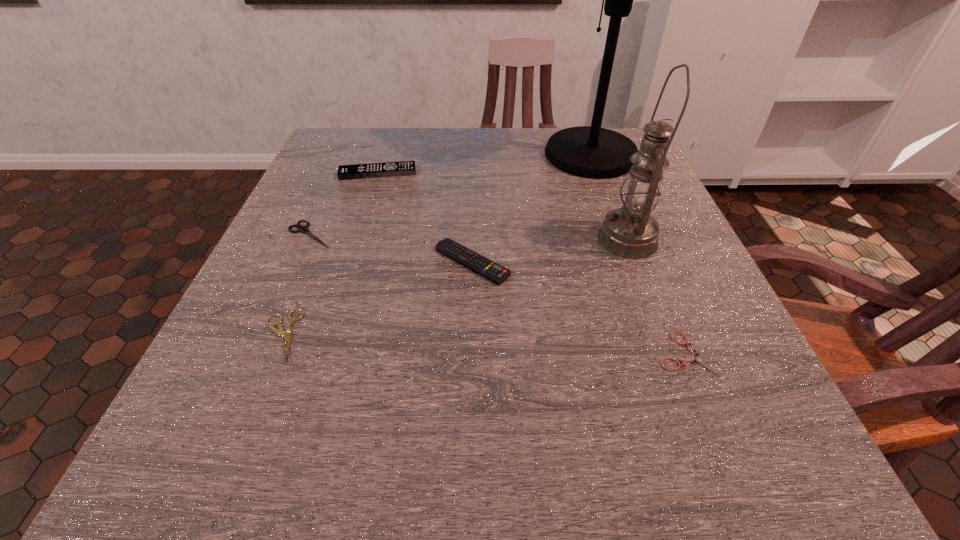
This screenshot has height=540, width=960. I want to click on table lamp, so click(593, 152).

Where is `the second tallest object`? the second tallest object is located at coordinates (631, 232).

Where is `the fifth shortest object`? This screenshot has width=960, height=540. the fifth shortest object is located at coordinates (404, 168).

Locate an element on the screen. the left remote control is located at coordinates point(404,168).

Find the location of a particular element. The image size is (960, 540). the fourth shortest object is located at coordinates (464, 256).

Image resolution: width=960 pixels, height=540 pixels. In order to click on the right remote control in this screenshot , I will do click(x=464, y=256).

Where is `the farthest shears`? the farthest shears is located at coordinates (303, 229).

The image size is (960, 540). In order to click on the tallest shears in this screenshot , I will do click(x=303, y=229).

Locate an element on the screen. The width and height of the screenshot is (960, 540). the second tallest shears is located at coordinates (288, 335).

Identify the location of the shortest object. (701, 360).